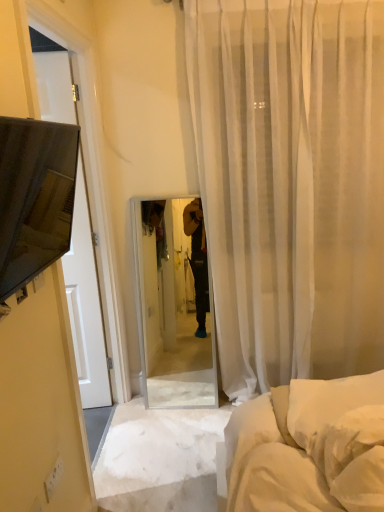
Question: Looking at the image, does sheer white curtain at center seem bigger or smaller compared to matte black tv at left?

Choices:
 (A) big
 (B) small

Answer: (A)

Question: Is sheer white curtain at center situated inside matte black tv at left or outside?

Choices:
 (A) outside
 (B) inside

Answer: (A)

Question: Estimate the real-world distances between objects in this image. Which object is closer to the matte black tv at left?

Choices:
 (A) white soft pillow at lower right
 (B) sheer white curtain at center

Answer: (A)

Question: Which of these objects is positioned closest to the sheer white curtain at center?

Choices:
 (A) matte black tv at left
 (B) white soft pillow at lower right

Answer: (B)